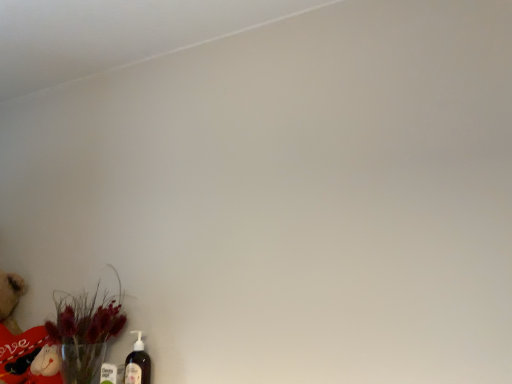
Describe the element at coordinates (138, 363) in the screenshot. I see `translucent plastic bottle at lower left` at that location.

The image size is (512, 384). What are the coordinates of `translucent plastic bottle at lower left` in the screenshot? It's located at (138, 363).

What do you see at coordinates (85, 330) in the screenshot? I see `translucent glass vase at lower left` at bounding box center [85, 330].

Find the location of a particular element. The width and height of the screenshot is (512, 384). translucent glass vase at lower left is located at coordinates (x=85, y=330).

Where is `translucent plastic bottle at lower left`? translucent plastic bottle at lower left is located at coordinates (138, 363).

Considering the positions of objects translucent glass vase at lower left and translucent plastic bottle at lower left in the image provided, who is more to the left, translucent glass vase at lower left or translucent plastic bottle at lower left?

translucent glass vase at lower left is more to the left.

Is translucent glass vase at lower left in front of translucent plastic bottle at lower left?

Yes, it is in front of translucent plastic bottle at lower left.

Is point (72, 331) positioned in front of point (133, 365)?

No, (72, 331) is further to viewer.

From the image's perspective, between translucent glass vase at lower left and translucent plastic bottle at lower left, which one is located above?

translucent glass vase at lower left appears higher in the image.

From a real-world perspective, is translucent glass vase at lower left on top of translucent plastic bottle at lower left?

Indeed, from a real-world perspective, translucent glass vase at lower left stands above translucent plastic bottle at lower left.

Based on the photo, which object is wider, translucent glass vase at lower left or translucent plastic bottle at lower left?

Wider between the two is translucent glass vase at lower left.

In terms of height, does translucent glass vase at lower left look taller or shorter compared to translucent plastic bottle at lower left?

Clearly, translucent glass vase at lower left is taller compared to translucent plastic bottle at lower left.

Between translucent glass vase at lower left and translucent plastic bottle at lower left, which one has larger size?

translucent glass vase at lower left.

Consider the image. Would you say translucent plastic bottle at lower left is part of translucent glass vase at lower left's contents?

No, translucent plastic bottle at lower left is not surrounded by translucent glass vase at lower left.

Is translucent glass vase at lower left far away from translucent plastic bottle at lower left?

No, translucent glass vase at lower left is not far away from translucent plastic bottle at lower left.

Is translucent plastic bottle at lower left at the back of translucent glass vase at lower left?

No, translucent glass vase at lower left's orientation is not away from translucent plastic bottle at lower left.

How different are the orientations of translucent glass vase at lower left and translucent plastic bottle at lower left in degrees?

The angular difference between translucent glass vase at lower left and translucent plastic bottle at lower left is 2.61 degrees.

Identify the location of bottle that is below the translucent glass vase at lower left (from the image's perspective). (138, 363).

Considering the positions of objects translucent plastic bottle at lower left and translucent glass vase at lower left in the image provided, who is more to the right, translucent plastic bottle at lower left or translucent glass vase at lower left?

From the viewer's perspective, translucent plastic bottle at lower left appears more on the right side.

Which object is closer to the camera, translucent plastic bottle at lower left or translucent glass vase at lower left?

translucent glass vase at lower left is closer to the camera.

Is point (127, 378) less distant than point (74, 299)?

That is True.

From the image's perspective, which is below, translucent plastic bottle at lower left or translucent glass vase at lower left?

translucent plastic bottle at lower left, from the image's perspective.

From a real-world perspective, does translucent plastic bottle at lower left stand above translucent glass vase at lower left?

No, from a real-world perspective, translucent plastic bottle at lower left is not over translucent glass vase at lower left

Does translucent plastic bottle at lower left have a lesser width compared to translucent glass vase at lower left?

Indeed, translucent plastic bottle at lower left has a lesser width compared to translucent glass vase at lower left.

Does translucent plastic bottle at lower left have a greater height compared to translucent glass vase at lower left?

In fact, translucent plastic bottle at lower left may be shorter than translucent glass vase at lower left.

Is translucent plastic bottle at lower left bigger than translucent glass vase at lower left?

No.

Is translucent plastic bottle at lower left not within translucent glass vase at lower left?

Absolutely, translucent plastic bottle at lower left is external to translucent glass vase at lower left.

Is translucent plastic bottle at lower left far from translucent glass vase at lower left?

No.

Could you tell me if translucent plastic bottle at lower left is facing translucent glass vase at lower left?

No, translucent plastic bottle at lower left does not turn towards translucent glass vase at lower left.

Where is `bottle below the translucent glass vase at lower left (from a real-world perspective)`? This screenshot has height=384, width=512. bottle below the translucent glass vase at lower left (from a real-world perspective) is located at coordinates (138, 363).

Find the location of `floral arrangement that is in front of the translucent plastic bottle at lower left`. floral arrangement that is in front of the translucent plastic bottle at lower left is located at coordinates (85, 330).

Find the location of a particular element. Image resolution: width=512 pixels, height=384 pixels. floral arrangement above the translucent plastic bottle at lower left (from a real-world perspective) is located at coordinates click(85, 330).